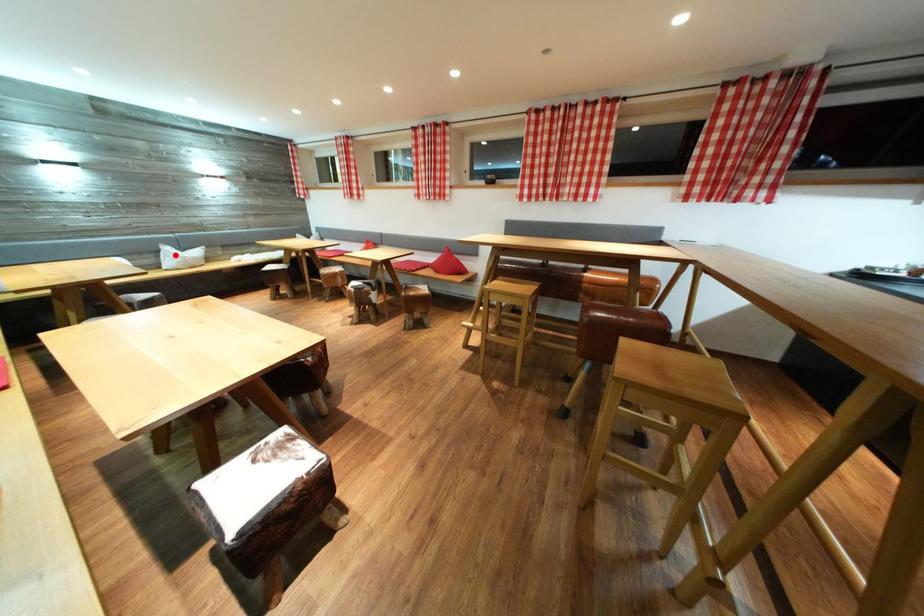
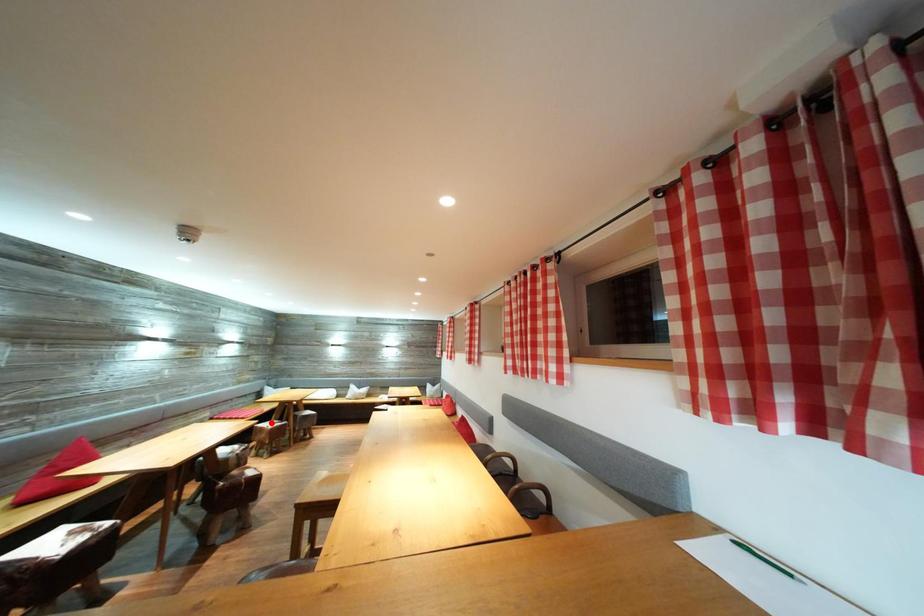
I am providing you with two images of the same scene from different viewpoints. A red point is marked on the first image and another point is marked on the second image. Is the red point in image1 aligned with the point shown in image2?

No